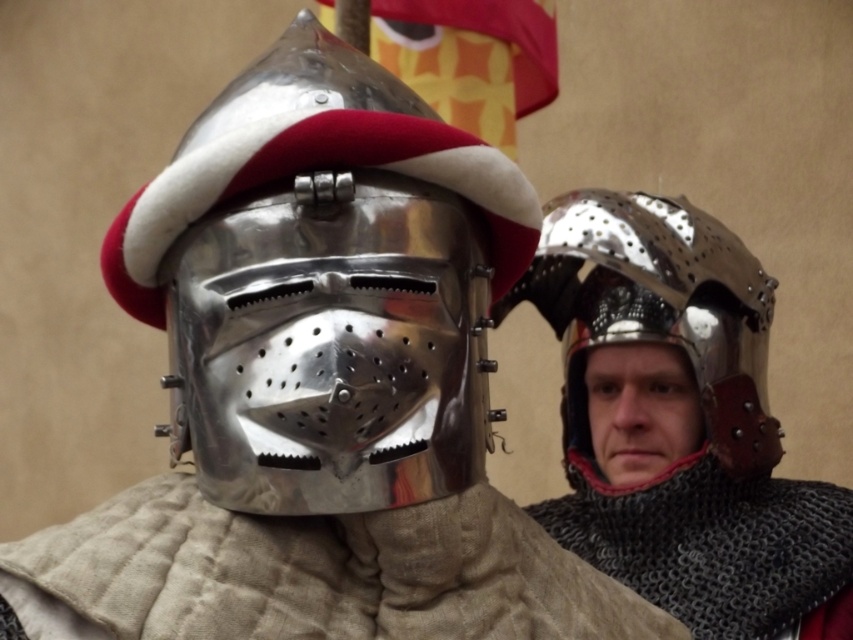
Where is `shiny metallic helmet at center`? The width and height of the screenshot is (853, 640). shiny metallic helmet at center is located at coordinates (323, 284).

Which is above, shiny metallic helmet at center or shiny metallic helmet at right?

shiny metallic helmet at center is above.

Does point (347, 465) lie behind point (547, 285)?

No, it is not.

The height and width of the screenshot is (640, 853). Identify the location of shiny metallic helmet at center. (323, 284).